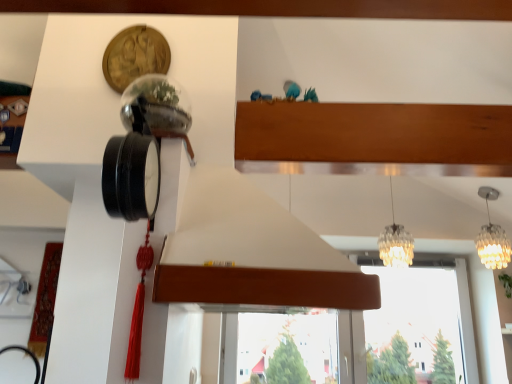
Question: Looking at their shapes, would you say wooden at upper center is wider or thinner than translucent glass chandelier at center, the 1th lamp in the left-to-right sequence?

Choices:
 (A) wide
 (B) thin

Answer: (A)

Question: Is wooden at upper center spatially inside translucent glass chandelier at center, the 1th lamp in the left-to-right sequence, or outside of it?

Choices:
 (A) inside
 (B) outside

Answer: (B)

Question: Which object is positioned closest to the transparent glass window at center?

Choices:
 (A) wooden at upper center
 (B) translucent glass chandelier at upper right, the 2th lamp when ordered from left to right
 (C) translucent glass chandelier at center, the 1th lamp in the left-to-right sequence

Answer: (C)

Question: Estimate the real-world distances between objects in this image. Which object is farther from the translucent glass chandelier at center, placed as the second lamp when sorted from right to left?

Choices:
 (A) transparent glass window at center
 (B) wooden at upper center
 (C) translucent glass chandelier at upper right, the 1th lamp in the right-to-left sequence

Answer: (B)